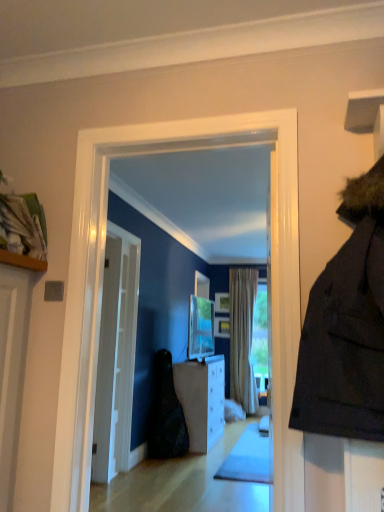
Question: Are matte silver tv at center and wooden picture frame at center, the second picture frame in the bottom-to-top sequence, making contact?

Choices:
 (A) no
 (B) yes

Answer: (A)

Question: Is matte silver tv at center in front of wooden picture frame at center, the 1th picture frame in the top-to-bottom sequence?

Choices:
 (A) yes
 (B) no

Answer: (A)

Question: Is matte silver tv at center not inside wooden picture frame at center, the 1th picture frame in the top-to-bottom sequence?

Choices:
 (A) no
 (B) yes

Answer: (B)

Question: Can you confirm if matte silver tv at center is thinner than wooden picture frame at center, the 1th picture frame in the top-to-bottom sequence?

Choices:
 (A) yes
 (B) no

Answer: (B)

Question: Is matte silver tv at center at the left side of wooden picture frame at center, the 1th picture frame in the top-to-bottom sequence?

Choices:
 (A) yes
 (B) no

Answer: (A)

Question: Is wooden picture frame at center, the 1th picture frame in the top-to-bottom sequence, at the back of matte silver tv at center?

Choices:
 (A) yes
 (B) no

Answer: (B)

Question: From a real-world perspective, is wooden picture frame at center, the second picture frame in the bottom-to-top sequence, located higher than matte silver tv at center?

Choices:
 (A) yes
 (B) no

Answer: (A)

Question: From a real-world perspective, is wooden picture frame at center, the 1th picture frame in the top-to-bottom sequence, beneath matte silver tv at center?

Choices:
 (A) no
 (B) yes

Answer: (A)

Question: Is wooden picture frame at center, the second picture frame in the bottom-to-top sequence, next to matte silver tv at center?

Choices:
 (A) no
 (B) yes

Answer: (A)

Question: Is wooden picture frame at center, the second picture frame in the bottom-to-top sequence, turned away from matte silver tv at center?

Choices:
 (A) yes
 (B) no

Answer: (B)

Question: Does wooden picture frame at center, the 1th picture frame in the top-to-bottom sequence, appear on the right side of matte silver tv at center?

Choices:
 (A) no
 (B) yes

Answer: (B)

Question: Is matte silver tv at center a part of wooden picture frame at center, the second picture frame in the bottom-to-top sequence?

Choices:
 (A) no
 (B) yes

Answer: (A)

Question: Is wooden picture frame at center, the 1th picture frame in the top-to-bottom sequence, completely or partially outside of white glossy door at center?

Choices:
 (A) no
 (B) yes

Answer: (B)